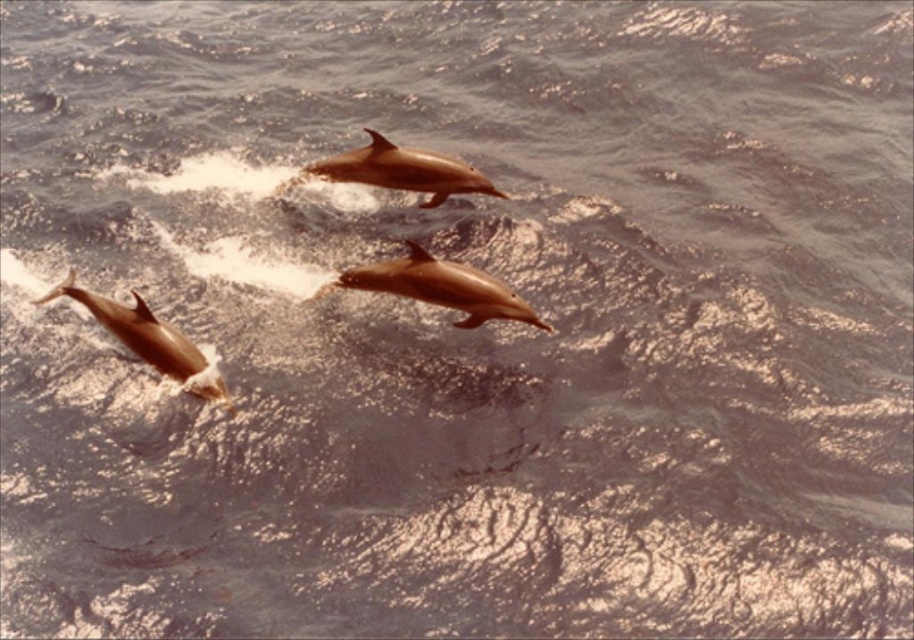
You are observing two dolphins in the ocean. You see a shiny brown dolphin at center and a smooth brown dolphin at center. Which dolphin is positioned to the right of the other?

The shiny brown dolphin at center is to the right of the smooth brown dolphin at center.

Based on the scene description, which dolphin is smaller in size between the shiny brown dolphin at center and the light brown smooth dolphin at lower left?

The shiny brown dolphin at center has a smaller size compared to the light brown smooth dolphin at lower left.

You are a marine biologist observing three dolphins leaping out of the ocean. You notice two specific dolphins labeled as the shiny brown dolphin at center and the smooth brown dolphin at center. Which of these two dolphins has a higher position in the air during their leap?

The shiny brown dolphin at center is much taller than the smooth brown dolphin at center, so it has a higher position in the air during their leap.